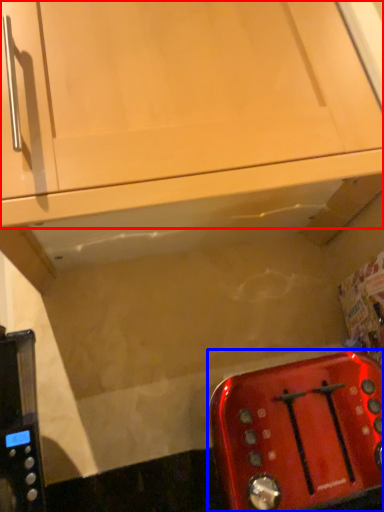
Question: Which of the following is the closest to the observer, cabinetry (highlighted by a red box) or toaster (highlighted by a blue box)?

Choices:
 (A) cabinetry
 (B) toaster

Answer: (B)